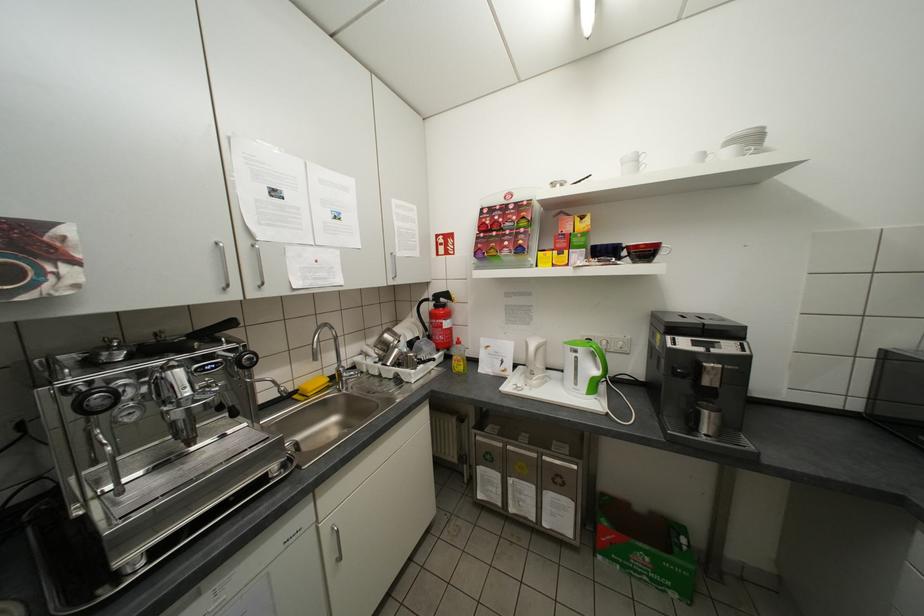
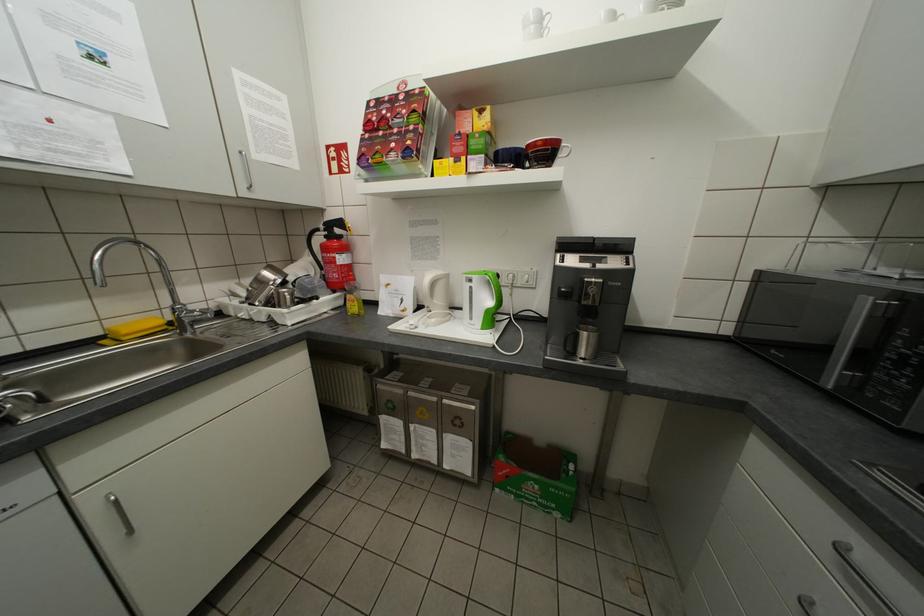
The point at (650, 246) is marked in the first image. Where is the corresponding point in the second image?

(548, 144)